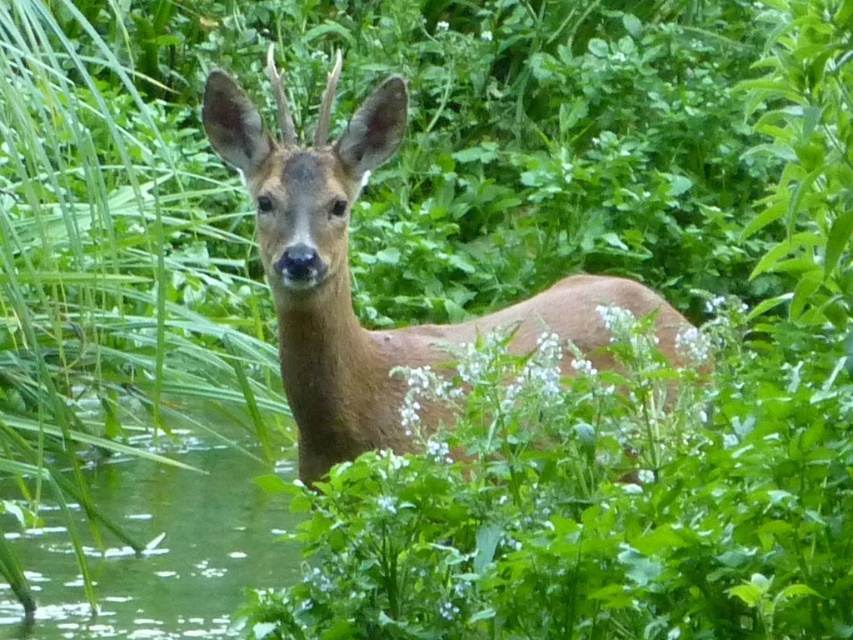
Question: Does brown matte deer at center appear on the right side of green liquid water at lower left?

Choices:
 (A) yes
 (B) no

Answer: (A)

Question: Among these objects, which one is farthest from the camera?

Choices:
 (A) green liquid water at lower left
 (B) brown matte deer at center

Answer: (A)

Question: Is brown matte deer at center above green liquid water at lower left?

Choices:
 (A) yes
 (B) no

Answer: (A)

Question: Which point is closer to the camera?

Choices:
 (A) (392, 138)
 (B) (223, 620)

Answer: (A)

Question: Is the position of brown matte deer at center more distant than that of green liquid water at lower left?

Choices:
 (A) no
 (B) yes

Answer: (A)